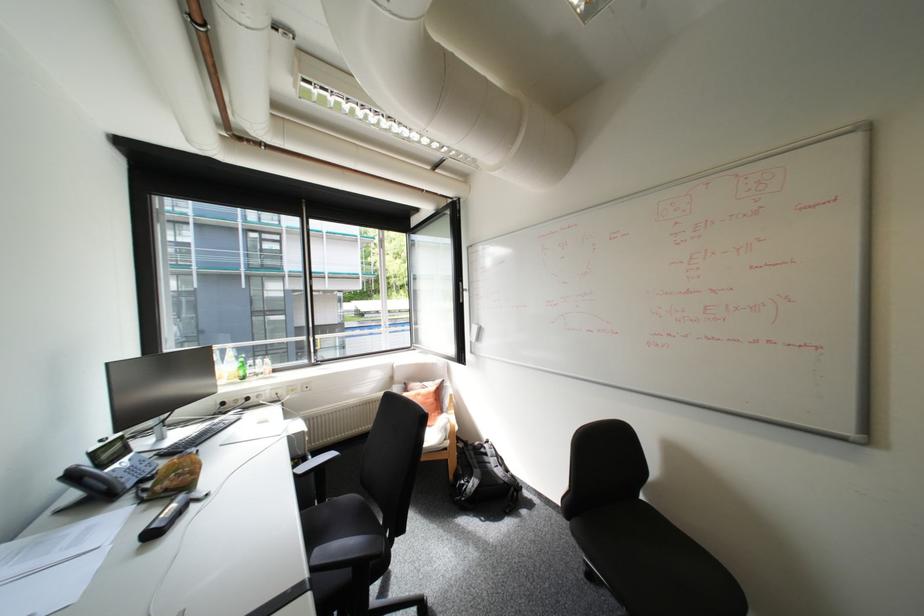
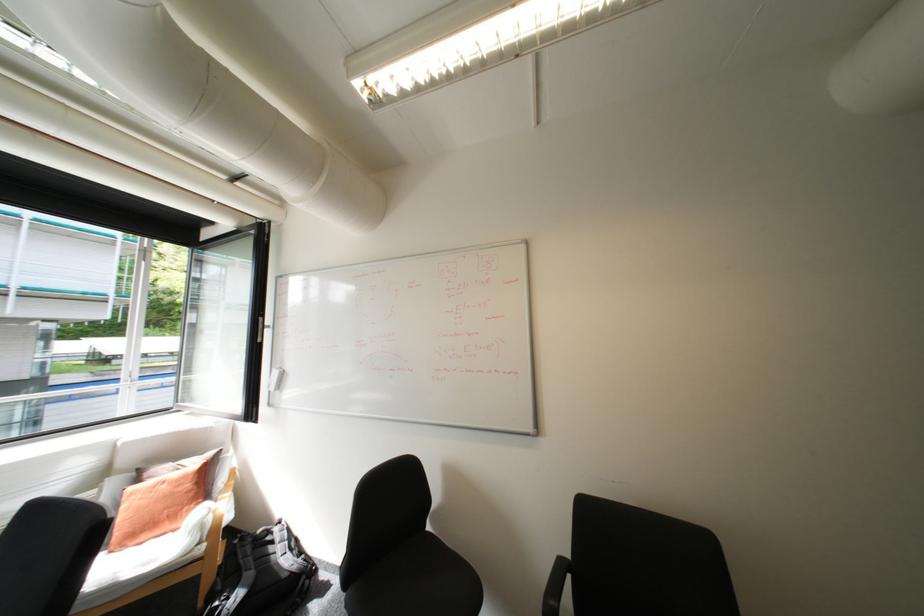
Where in the second image is the point corresponding to the point at 470,290 from the first image?

(271, 326)